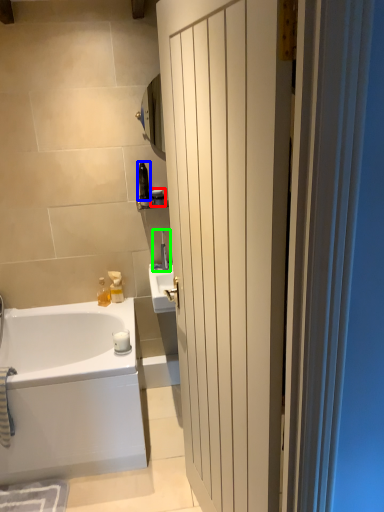
Question: Which object is positioned farthest from toiletry (highlighted by a red box)? Select from toiletry (highlighted by a blue box) and faucet (highlighted by a green box).

Choices:
 (A) toiletry
 (B) faucet

Answer: (B)